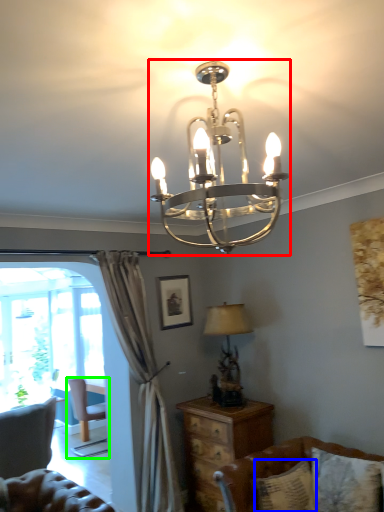
Question: Estimate the real-world distances between objects in this image. Which object is closer to lamp (highlighted by a red box), pillow (highlighted by a blue box) or chair (highlighted by a green box)?

Choices:
 (A) pillow
 (B) chair

Answer: (A)